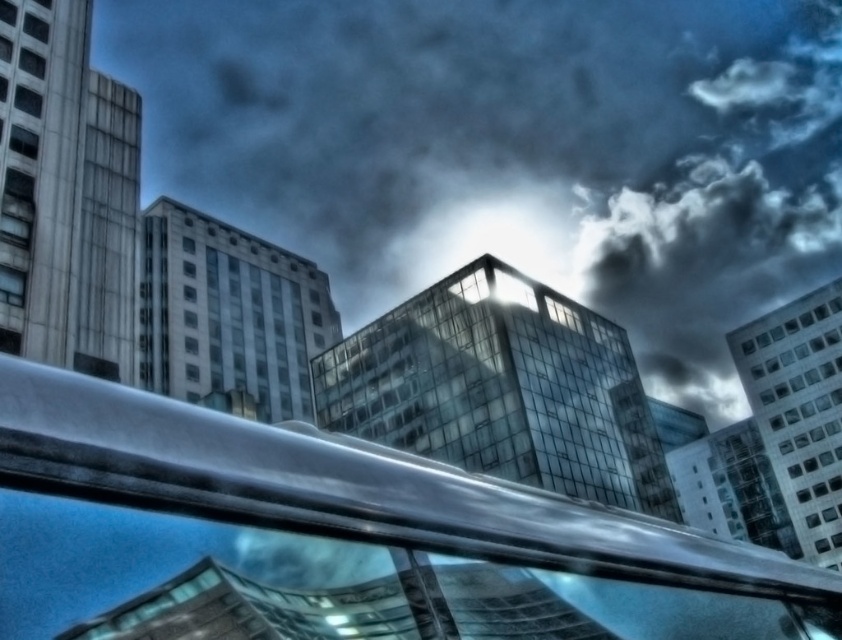
You are standing on a balcony overlooking the city. You see a transparent glass building at center and a metallic silver railing at center. Which object is closer to you?

The metallic silver railing at center is closer to you because it is positioned under the transparent glass building at center, indicating it is in front.

You are standing in the urban scene and want to locate the transparent glass building at center. What are its coordinates?

The transparent glass building at center is located at coordinates point (512, 150).

You are a photographer trying to capture the transparent glass building at center through the metallic silver railing at center. Given their sizes, will the railing block most of the building in your photo?

The transparent glass building at center is larger in size than the metallic silver railing at center, so the railing will not block most of the building in your photo.